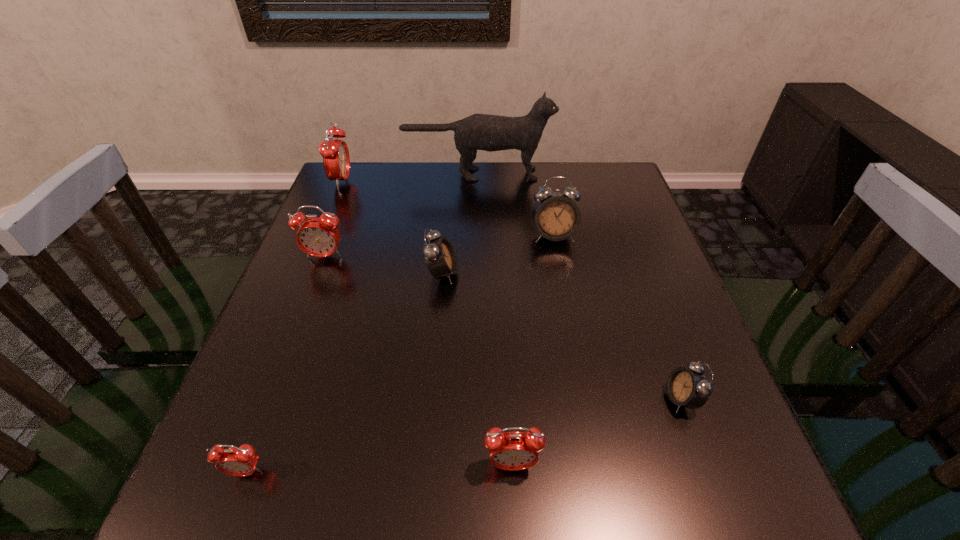
Where is `vacant space that satisfies the following two spatial constraints: 1. on the face of the rightmost object; 2. on the face of the fifth alarm clock from left to right`? The image size is (960, 540). vacant space that satisfies the following two spatial constraints: 1. on the face of the rightmost object; 2. on the face of the fifth alarm clock from left to right is located at coordinates (706, 465).

You are a GUI agent. You are given a task and a screenshot of the screen. Output one action in this format:
    pyautogui.click(x=<x>, y=<y>)
    Task: Click on the free region that satisfies the following two spatial constraints: 1. on the face of the rightmost alarm clock; 2. on the face of the fifth alarm clock from left to right
    The width and height of the screenshot is (960, 540).
    Given the screenshot: What is the action you would take?
    706,465

You are a GUI agent. You are given a task and a screenshot of the screen. Output one action in this format:
    pyautogui.click(x=<x>, y=<y>)
    Task: Click on the vacant space that satisfies the following two spatial constraints: 1. on the face of the fourth alarm clock from right to left; 2. on the face of the smallest red alarm clock
    
    Given the screenshot: What is the action you would take?
    pyautogui.click(x=424, y=472)